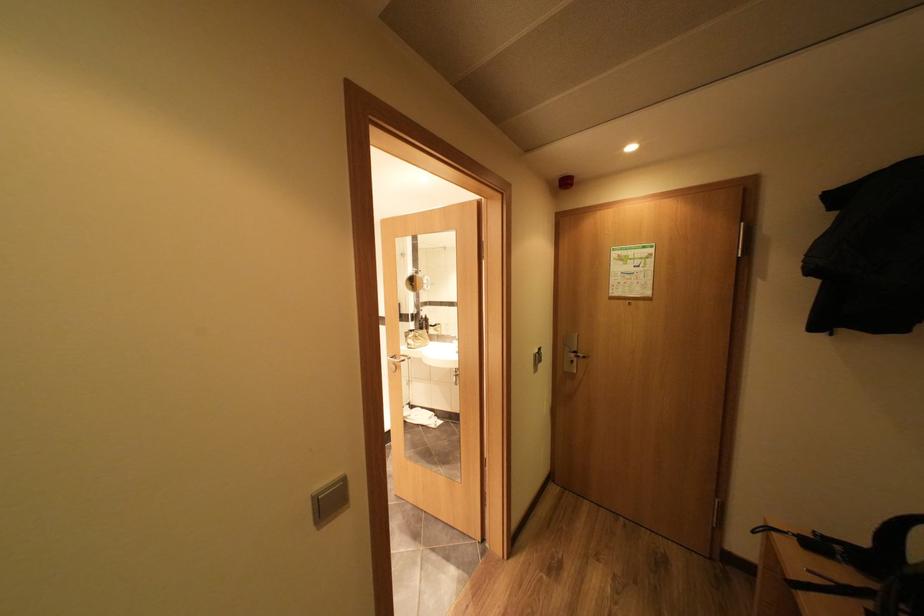
Find where to lift the black handbag. Please return your answer as a coordinate pair (x, y).

(867, 565)